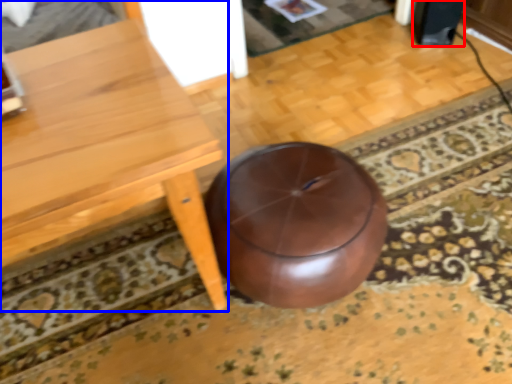
Question: Which object appears farthest to the camera in this image, speaker (highlighted by a red box) or table (highlighted by a blue box)?

Choices:
 (A) speaker
 (B) table

Answer: (A)